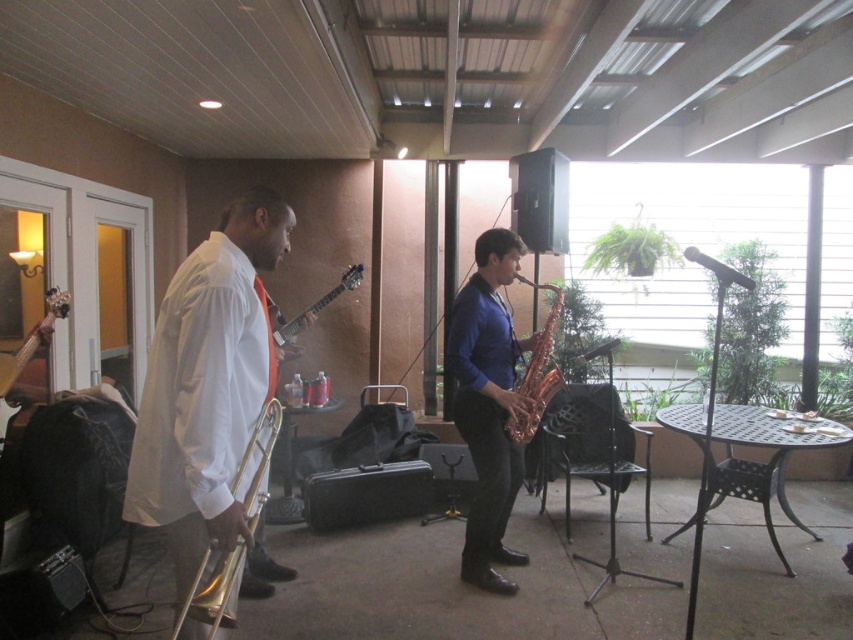
Can you confirm if shiny gold saxophone at center is positioned to the left of glossy wood guitar at center?

Incorrect, shiny gold saxophone at center is not on the left side of glossy wood guitar at center.

Can you confirm if shiny gold saxophone at center is bigger than glossy wood guitar at center?

Indeed, shiny gold saxophone at center has a larger size compared to glossy wood guitar at center.

Between point (486, 244) and point (276, 321), which one is positioned in front?

Point (486, 244) is in front.

In order to click on shiny gold saxophone at center in this screenshot , I will do `click(488, 404)`.

Does shiny gold trombone at left appear on the left side of wooden acoustic guitar at left?

Incorrect, shiny gold trombone at left is not on the left side of wooden acoustic guitar at left.

Between shiny gold trombone at left and wooden acoustic guitar at left, which one appears on the left side from the viewer's perspective?

wooden acoustic guitar at left

Who is more forward, (195, 435) or (41, 339)?

Point (195, 435) is in front.

Locate an element on the screen. The image size is (853, 640). shiny gold trombone at left is located at coordinates (206, 385).

Does point (526, 420) come in front of point (276, 342)?

Yes.

Between gold shiny saxophone at center and glossy wood guitar at center, which one has less height?

Standing shorter between the two is glossy wood guitar at center.

Is point (534, 378) behind point (270, 330)?

Yes, point (534, 378) is behind point (270, 330).

Where is `gold shiny saxophone at center`? The height and width of the screenshot is (640, 853). gold shiny saxophone at center is located at coordinates (537, 371).